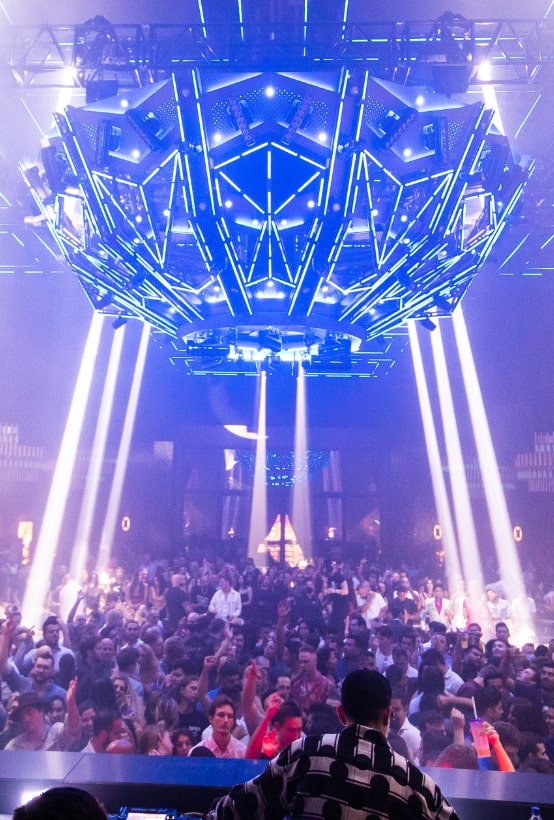
I want to click on light, so click(454, 476).